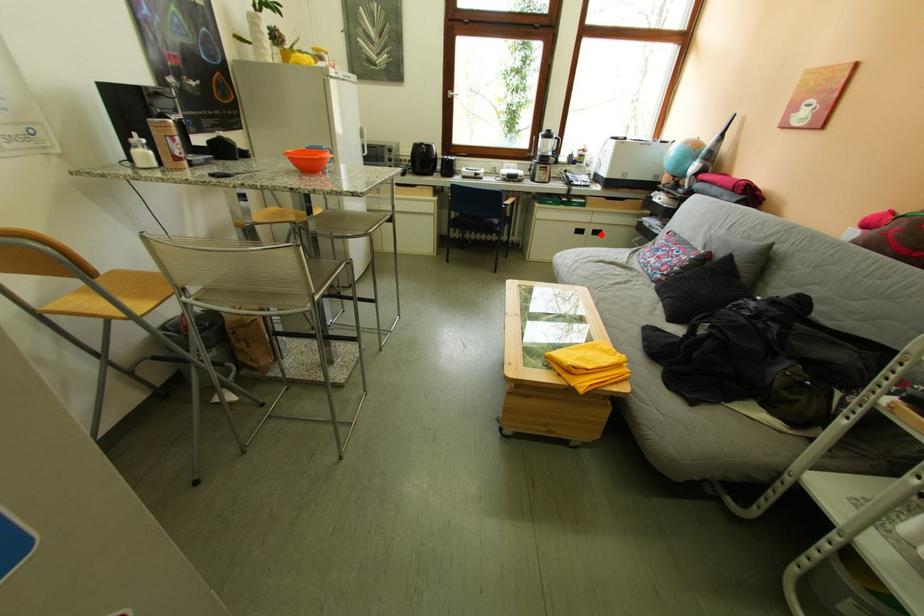
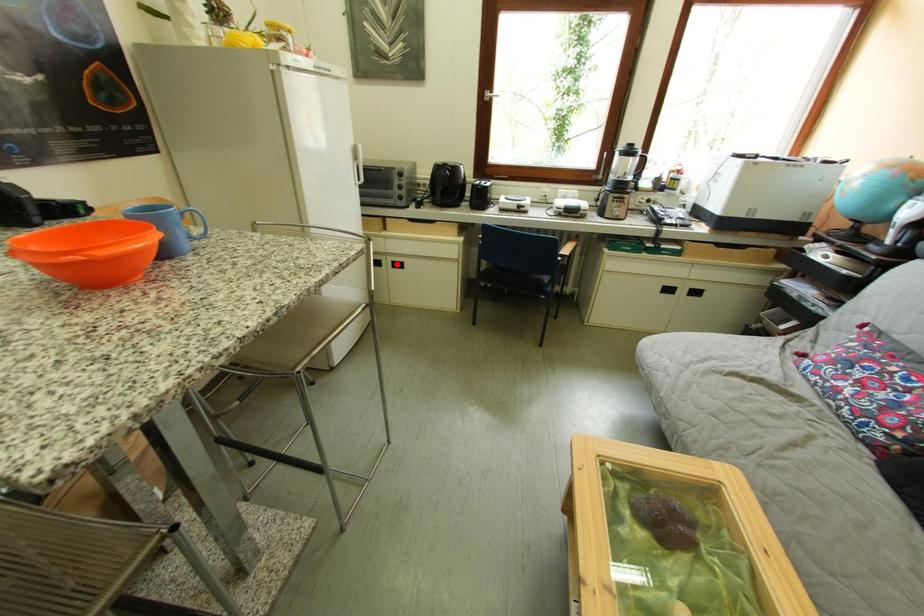
I am providing you with two images of the same scene from different viewpoints. A red point is marked on the first image and another point is marked on the second image. Do the highlighted points in image1 and image2 indicate the same real-world spot?

No